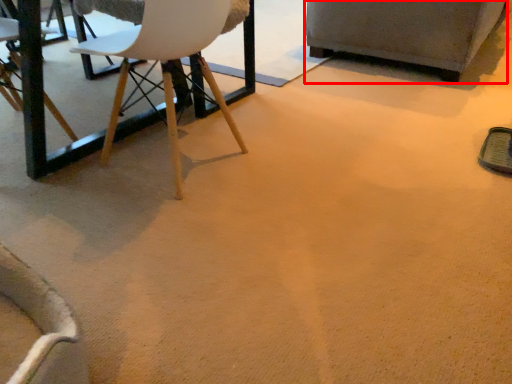
Question: From the image's perspective, where is armchair (annotated by the red box) located relative to chair?

Choices:
 (A) below
 (B) above

Answer: (B)